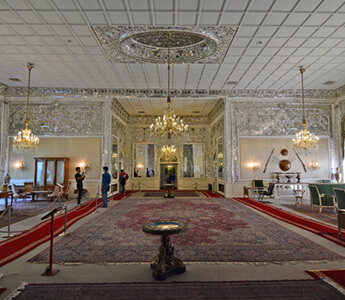
Where is `glittery rectangular sections of the wall`? This screenshot has height=300, width=345. glittery rectangular sections of the wall is located at coordinates pyautogui.click(x=81, y=112), pyautogui.click(x=76, y=91), pyautogui.click(x=268, y=124).